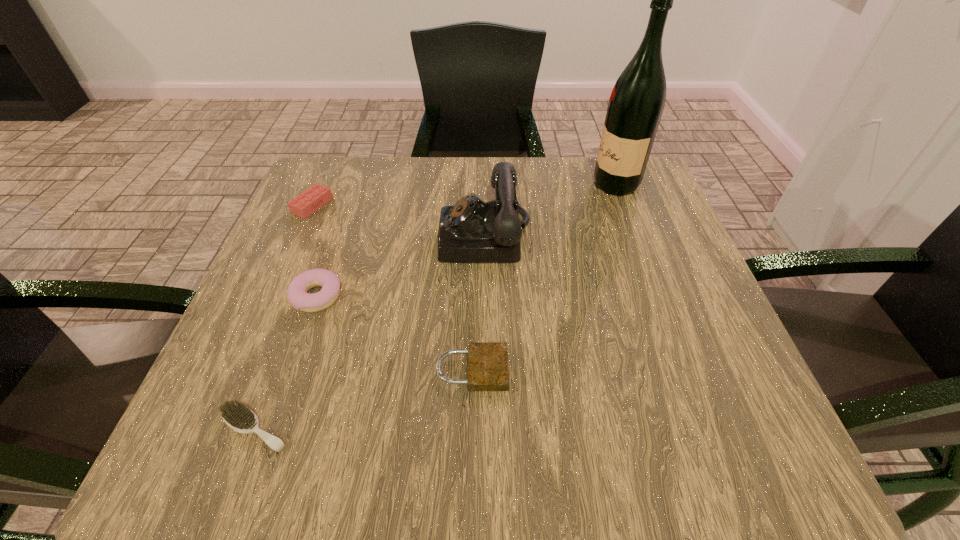
At what (x,y) coordinates should I click in order to perform the action: click on object positioned at the near edge. Please return your answer as a coordinate pair (x, y). The height and width of the screenshot is (540, 960). Looking at the image, I should click on (238, 417).

The height and width of the screenshot is (540, 960). I want to click on doughnut located in the left edge section of the desktop, so click(297, 290).

Locate an element on the screen. This screenshot has height=540, width=960. Lego that is at the left edge is located at coordinates (306, 203).

Locate an element on the screen. scrubbing brush at the left edge is located at coordinates (238, 417).

At what (x,y) coordinates should I click in order to perform the action: click on object present at the right edge. Please return your answer as a coordinate pair (x, y). Looking at the image, I should click on (636, 104).

You are a GUI agent. You are given a task and a screenshot of the screen. Output one action in this format:
    pyautogui.click(x=<x>, y=<y>)
    Task: Click on the object that is at the far left corner
    The width and height of the screenshot is (960, 540).
    Given the screenshot: What is the action you would take?
    pyautogui.click(x=306, y=203)

Locate an element on the screen. The width and height of the screenshot is (960, 540). object that is at the near left corner is located at coordinates (238, 417).

At what (x,y) coordinates should I click in order to perform the action: click on object that is at the far right corner. Please return your answer as a coordinate pair (x, y). Looking at the image, I should click on 636,104.

In the image, there is a desktop. Find the location of `vacant space at the far edge`. vacant space at the far edge is located at coordinates (492, 174).

You are a GUI agent. You are given a task and a screenshot of the screen. Output one action in this format:
    pyautogui.click(x=<x>, y=<y>)
    Task: Click on the free location at the near edge of the desktop
    
    Given the screenshot: What is the action you would take?
    pyautogui.click(x=337, y=423)